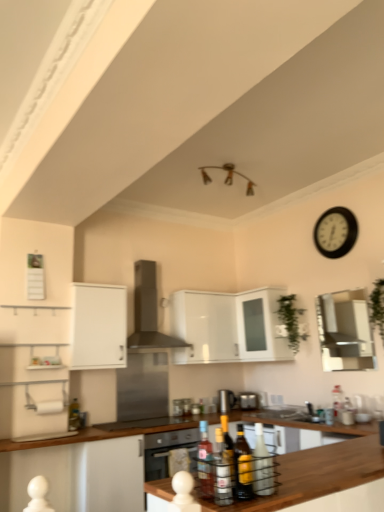
Question: From the image's perspective, is green leafy plant at upper center, which is counted as the 2th plant, starting from the right, over green leafy plant at right, placed as the 1th plant when sorted from right to left?

Choices:
 (A) no
 (B) yes

Answer: (A)

Question: From a real-world perspective, is green leafy plant at upper center, the 2th plant viewed from the front, under green leafy plant at right, placed as the 1th plant when sorted from right to left?

Choices:
 (A) yes
 (B) no

Answer: (B)

Question: Is the depth of green leafy plant at upper center, the 2th plant viewed from the front, greater than that of green leafy plant at right, placed as the 1th plant when sorted from right to left?

Choices:
 (A) yes
 (B) no

Answer: (A)

Question: Is green leafy plant at right, which appears as the 2th plant when viewed from the back, at the back of green leafy plant at upper center, positioned as the first plant in back-to-front order?

Choices:
 (A) yes
 (B) no

Answer: (B)

Question: Can you confirm if green leafy plant at upper center, acting as the first plant starting from the left, is thinner than green leafy plant at right, which appears as the 2th plant when viewed from the back?

Choices:
 (A) yes
 (B) no

Answer: (A)

Question: From a real-world perspective, is green leafy plant at upper center, positioned as the first plant in back-to-front order, physically located above or below translucent glass bottle at lower left, the 5th bottle positioned from the front?

Choices:
 (A) above
 (B) below

Answer: (A)

Question: Does point (289, 305) appear closer or farther from the camera than point (69, 408)?

Choices:
 (A) closer
 (B) farther

Answer: (B)

Question: From the image's perspective, relative to translucent glass bottle at lower left, acting as the first bottle starting from the back, is green leafy plant at upper center, the 2th plant viewed from the front, above or below?

Choices:
 (A) above
 (B) below

Answer: (A)

Question: Considering the positions of green leafy plant at upper center, positioned as the first plant in back-to-front order, and translucent glass bottle at lower left, the 5th bottle positioned from the front, in the image, is green leafy plant at upper center, positioned as the first plant in back-to-front order, wider or thinner than translucent glass bottle at lower left, the 5th bottle positioned from the front,?

Choices:
 (A) thin
 (B) wide

Answer: (B)

Question: Based on their positions, is black plastic clock at upper right located to the left or right of white glossy cabinet at upper center, the 2th cabinetry in the left-to-right sequence?

Choices:
 (A) right
 (B) left

Answer: (A)

Question: In the image, is black plastic clock at upper right positioned in front of or behind white glossy cabinet at upper center, which is counted as the 1th cabinetry, starting from the right?

Choices:
 (A) behind
 (B) front

Answer: (A)

Question: From the image's perspective, relative to white glossy cabinet at upper center, which is counted as the 1th cabinetry, starting from the right, is black plastic clock at upper right above or below?

Choices:
 (A) below
 (B) above

Answer: (B)

Question: Is black plastic clock at upper right taller or shorter than white glossy cabinet at upper center, which is counted as the 1th cabinetry, starting from the right?

Choices:
 (A) short
 (B) tall

Answer: (A)

Question: Looking at the image, does translucent glass bottle at center, which ranks as the 2th bottle in left-to-right order, seem bigger or smaller compared to translucent glass bottles at center, the fifth bottle viewed from the back?

Choices:
 (A) big
 (B) small

Answer: (B)

Question: From a real-world perspective, relative to translucent glass bottles at center, positioned as the third bottle in left-to-right order, is translucent glass bottle at center, placed as the fourth bottle when sorted from right to left, vertically above or below?

Choices:
 (A) below
 (B) above

Answer: (B)